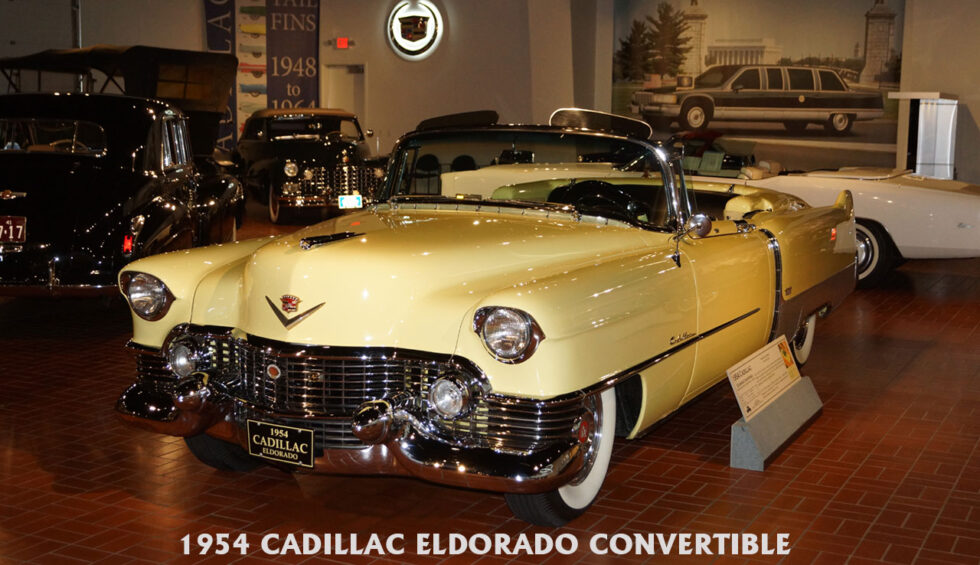
Locate an element on the screen. card holder is located at coordinates (789, 421).